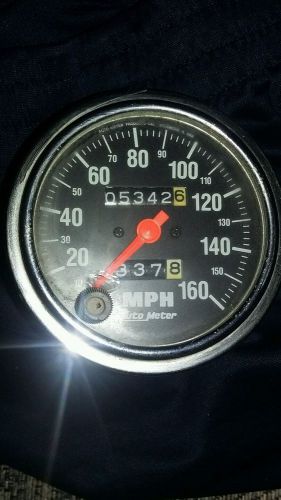
I want to click on gray fabric, so click(21, 490), click(262, 494).